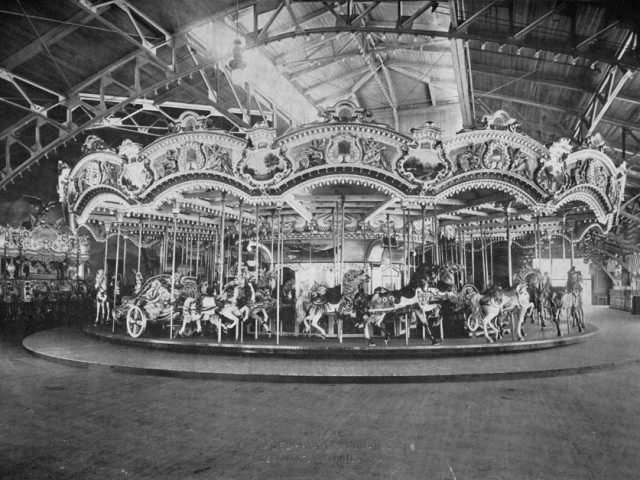
I want to click on floor, so click(349, 446).